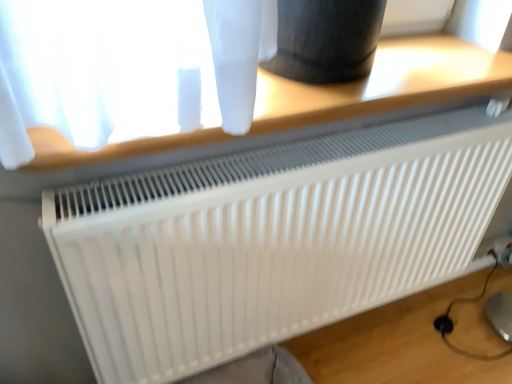
Question: Does white plastic table at upper center have a greater height compared to white matte radiator at center?

Choices:
 (A) yes
 (B) no

Answer: (B)

Question: Does white plastic table at upper center have a lesser height compared to white matte radiator at center?

Choices:
 (A) yes
 (B) no

Answer: (A)

Question: From the image's perspective, does white plastic table at upper center appear lower than white matte radiator at center?

Choices:
 (A) yes
 (B) no

Answer: (B)

Question: Is white plastic table at upper center positioned behind white matte radiator at center?

Choices:
 (A) yes
 (B) no

Answer: (B)

Question: Does white plastic table at upper center come in front of white matte radiator at center?

Choices:
 (A) no
 (B) yes

Answer: (B)

Question: From the image's perspective, is white plastic table at upper center over white matte radiator at center?

Choices:
 (A) yes
 (B) no

Answer: (A)

Question: Is white matte radiator at center wider than white plastic table at upper center?

Choices:
 (A) no
 (B) yes

Answer: (A)

Question: Are white matte radiator at center and white plastic table at upper center far apart?

Choices:
 (A) no
 (B) yes

Answer: (A)

Question: Can we say white matte radiator at center lies outside white plastic table at upper center?

Choices:
 (A) no
 (B) yes

Answer: (B)

Question: Is white matte radiator at center to the left of white plastic table at upper center from the viewer's perspective?

Choices:
 (A) yes
 (B) no

Answer: (B)

Question: Does white matte radiator at center touch white plastic table at upper center?

Choices:
 (A) no
 (B) yes

Answer: (A)

Question: From the image's perspective, is white matte radiator at center above white plastic table at upper center?

Choices:
 (A) no
 (B) yes

Answer: (A)

Question: Relative to white matte radiator at center, is white plastic table at upper center in front or behind?

Choices:
 (A) front
 (B) behind

Answer: (A)